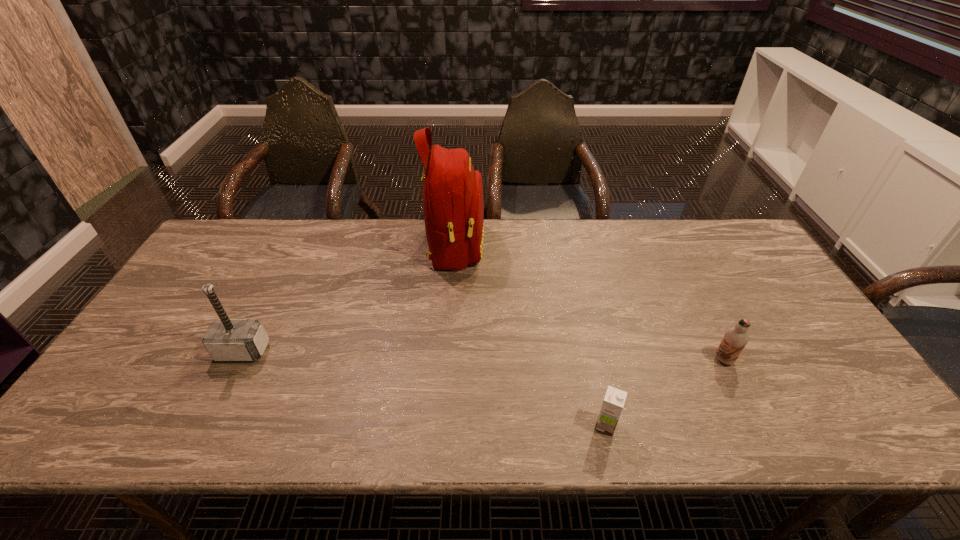
Locate an element on the screen. the tallest object is located at coordinates (453, 205).

Identify the location of the third object from right to left. The width and height of the screenshot is (960, 540). (453, 205).

The image size is (960, 540). I want to click on the second tallest object, so click(x=226, y=339).

In order to click on the leftmost object in this screenshot , I will do `click(226, 339)`.

Locate an element on the screen. The image size is (960, 540). the rightmost object is located at coordinates (735, 339).

This screenshot has height=540, width=960. I want to click on the right chocolate milk, so tap(735, 339).

Identify the location of the left chocolate milk. The image size is (960, 540). (614, 400).

Locate an element on the screen. the shortest object is located at coordinates (614, 400).

Identify the location of vacant space located 0.060m on the front-facing side of the third object from right to left. (503, 246).

Find the location of a particular element. free region located for striking with the head of the hammer is located at coordinates (198, 439).